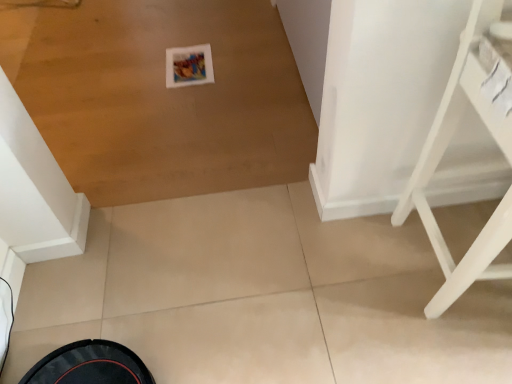
You are a GUI agent. You are given a task and a screenshot of the screen. Output one action in this format:
    pyautogui.click(x=<x>, y=<y>)
    Task: Click on the white wood ladder at right
    This screenshot has height=384, width=512.
    Given the screenshot: What is the action you would take?
    [x=443, y=154]

The width and height of the screenshot is (512, 384). What do you see at coordinates (443, 154) in the screenshot? I see `white wood ladder at right` at bounding box center [443, 154].

Find the location of a particular element. The height and width of the screenshot is (384, 512). white wood ladder at right is located at coordinates click(443, 154).